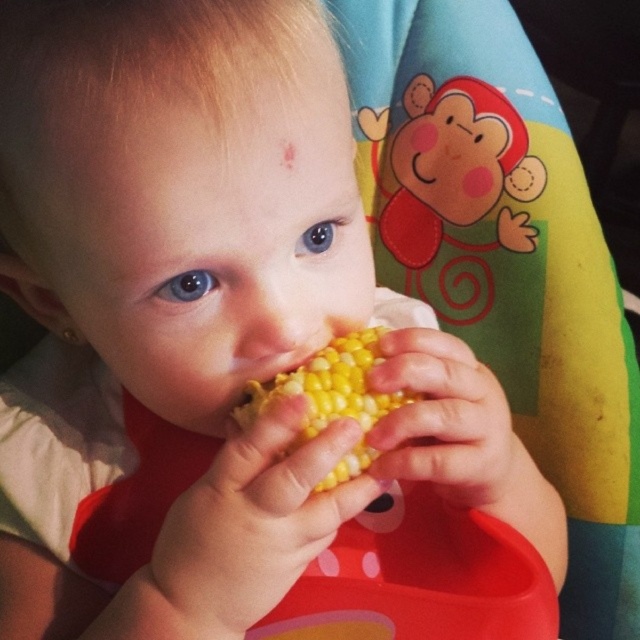
Question: Is yellow matte corn at center above smooth skin ear at left?

Choices:
 (A) yes
 (B) no

Answer: (B)

Question: Does yellow matte corn at center appear on the right side of smooth skin ear at left?

Choices:
 (A) yes
 (B) no

Answer: (A)

Question: Observing the image, what is the correct spatial positioning of yellow matte corn at center in reference to smooth skin ear at left?

Choices:
 (A) left
 (B) right

Answer: (B)